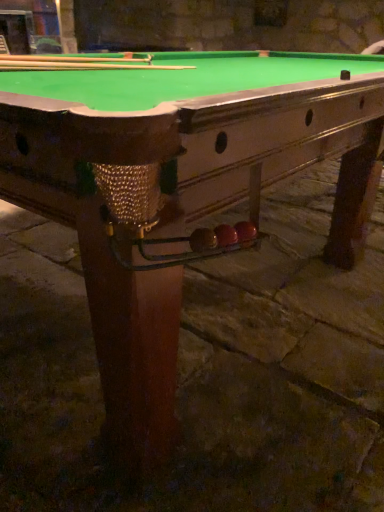
Where is `empty space that is ontop of smooth wood cue at upper left, acting as the 1th cue starting from the back (from a real-world perspective)`? empty space that is ontop of smooth wood cue at upper left, acting as the 1th cue starting from the back (from a real-world perspective) is located at coordinates (103, 57).